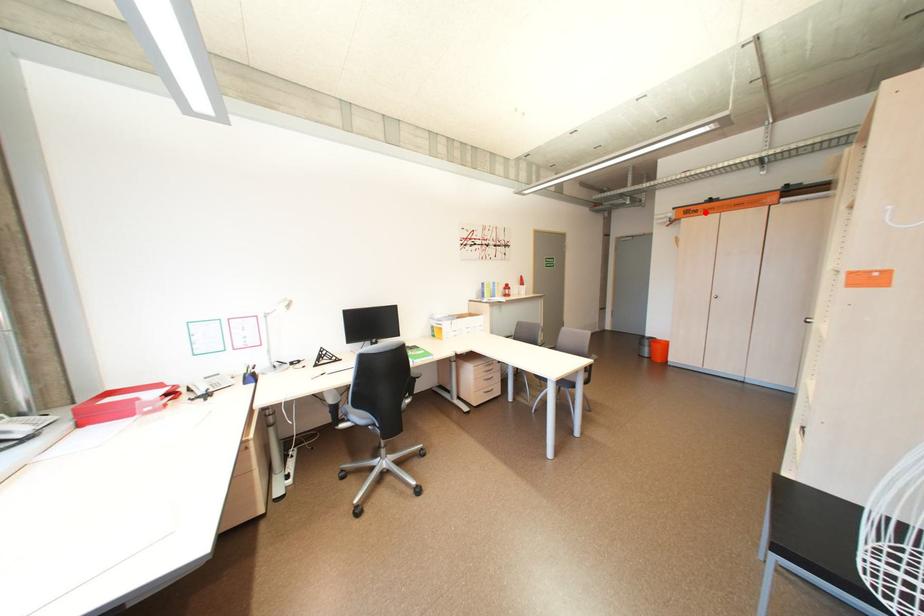
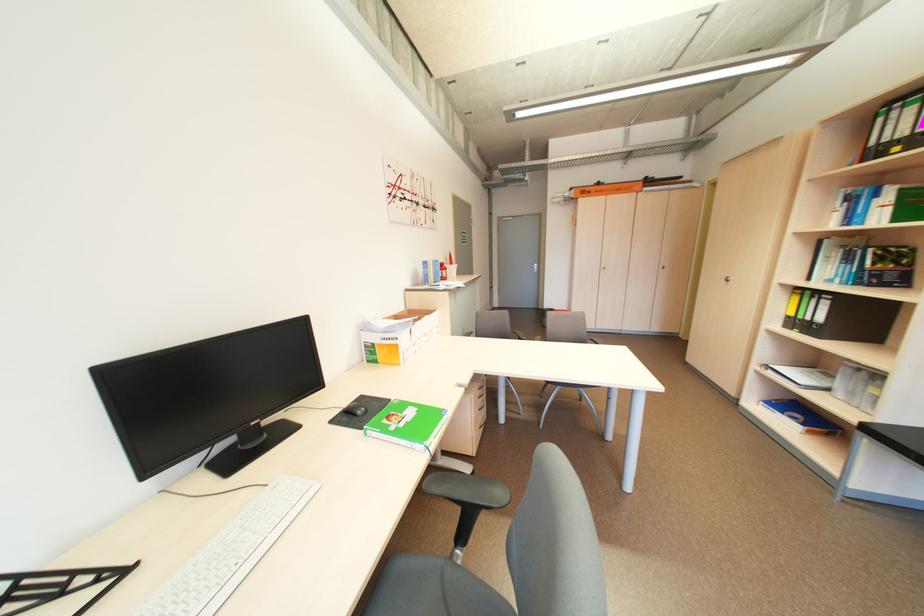
Find the pixel in the second image that matches the highlighted location in the first image.

(599, 193)